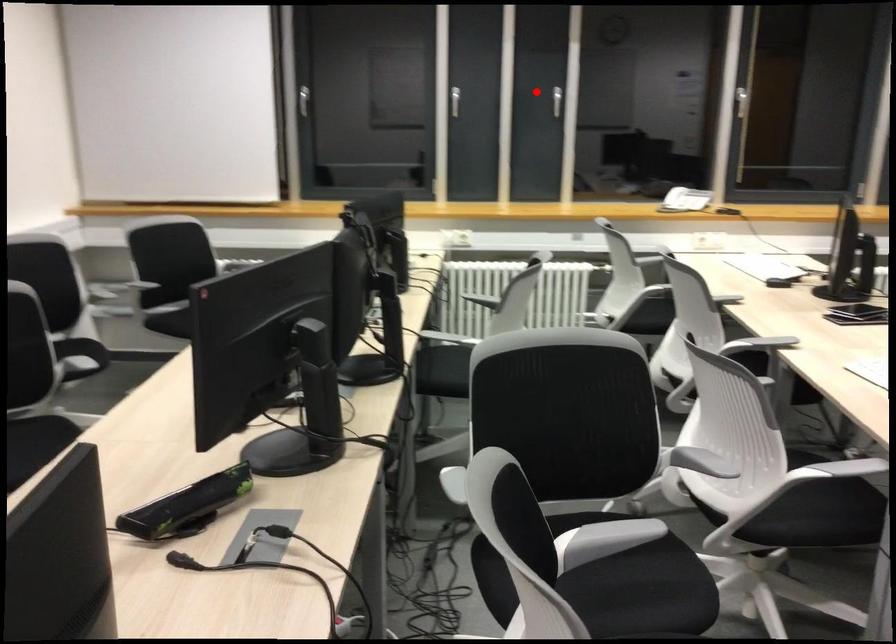
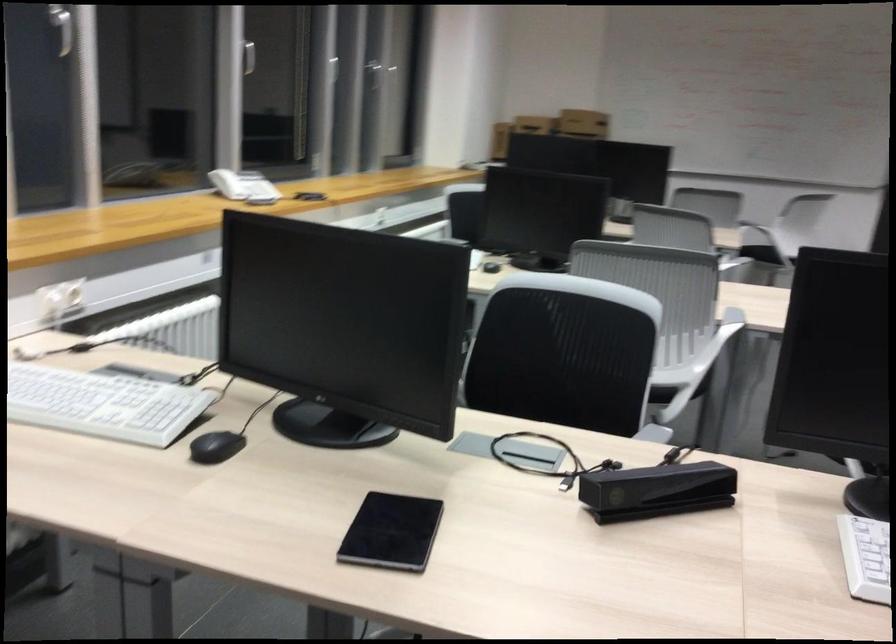
Find the pixel in the second image that matches the highlighted location in the first image.

(62, 26)